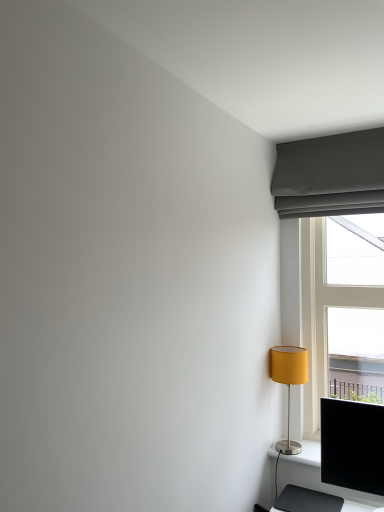
Question: From the image's perspective, is matte gray curtain at upper right on matte yellow fabric lampshade at right?

Choices:
 (A) no
 (B) yes

Answer: (B)

Question: Is matte gray curtain at upper right completely or partially outside of matte yellow fabric lampshade at right?

Choices:
 (A) no
 (B) yes

Answer: (B)

Question: Does matte gray curtain at upper right have a greater height compared to matte yellow fabric lampshade at right?

Choices:
 (A) no
 (B) yes

Answer: (A)

Question: From the image's perspective, does matte gray curtain at upper right appear lower than matte yellow fabric lampshade at right?

Choices:
 (A) no
 (B) yes

Answer: (A)

Question: Is matte gray curtain at upper right further to camera compared to matte yellow fabric lampshade at right?

Choices:
 (A) yes
 (B) no

Answer: (B)

Question: Does point (312, 145) appear closer or farther from the camera than point (359, 386)?

Choices:
 (A) farther
 (B) closer

Answer: (B)

Question: In terms of height, does matte gray curtain at upper right look taller or shorter compared to white plastic window at right?

Choices:
 (A) tall
 (B) short

Answer: (B)

Question: In the image, is matte gray curtain at upper right positioned in front of or behind white plastic window at right?

Choices:
 (A) behind
 (B) front

Answer: (B)

Question: Based on their sizes in the image, would you say matte gray curtain at upper right is bigger or smaller than white plastic window at right?

Choices:
 (A) small
 (B) big

Answer: (A)

Question: Considering the positions of matte gray curtain at upper right and matte yellow fabric lampshade at right in the image, is matte gray curtain at upper right bigger or smaller than matte yellow fabric lampshade at right?

Choices:
 (A) small
 (B) big

Answer: (B)

Question: Is matte gray curtain at upper right wider or thinner than matte yellow fabric lampshade at right?

Choices:
 (A) thin
 (B) wide

Answer: (A)

Question: Considering the relative positions of matte gray curtain at upper right and matte yellow fabric lampshade at right in the image provided, is matte gray curtain at upper right to the left or to the right of matte yellow fabric lampshade at right?

Choices:
 (A) left
 (B) right

Answer: (B)

Question: In terms of height, does matte gray curtain at upper right look taller or shorter compared to matte yellow fabric lampshade at right?

Choices:
 (A) tall
 (B) short

Answer: (B)

Question: From the image's perspective, is matte yellow fabric lampshade at right above or below matte gray curtain at upper right?

Choices:
 (A) below
 (B) above

Answer: (A)

Question: In the image, is matte yellow fabric lampshade at right positioned in front of or behind matte gray curtain at upper right?

Choices:
 (A) front
 (B) behind

Answer: (B)